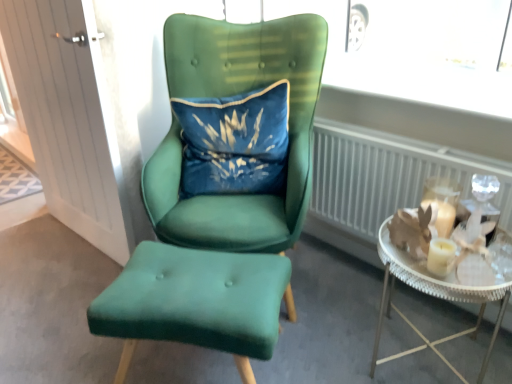
Question: Does white wood door at left have a lesser height compared to metallic silver tray at right?

Choices:
 (A) no
 (B) yes

Answer: (A)

Question: From a real-world perspective, does white wood door at left stand above metallic silver tray at right?

Choices:
 (A) no
 (B) yes

Answer: (B)

Question: From the image's perspective, is white wood door at left beneath metallic silver tray at right?

Choices:
 (A) yes
 (B) no

Answer: (B)

Question: Is white wood door at left in front of metallic silver tray at right?

Choices:
 (A) yes
 (B) no

Answer: (B)

Question: Is white wood door at left facing towards metallic silver tray at right?

Choices:
 (A) no
 (B) yes

Answer: (A)

Question: Considering their positions, is white wood door at left located in front of or behind velvet green chair at center, which appears as the second chair when ordered from the bottom?

Choices:
 (A) behind
 (B) front

Answer: (A)

Question: Considering the positions of white wood door at left and velvet green chair at center, which appears as the second chair when ordered from the bottom, in the image, is white wood door at left taller or shorter than velvet green chair at center, which appears as the second chair when ordered from the bottom,?

Choices:
 (A) tall
 (B) short

Answer: (A)

Question: Is white wood door at left inside or outside of velvet green chair at center, positioned as the first chair in top-to-bottom order?

Choices:
 (A) inside
 (B) outside

Answer: (B)

Question: From the image's perspective, relative to velvet green chair at center, which appears as the second chair when ordered from the bottom, is white wood door at left above or below?

Choices:
 (A) below
 (B) above

Answer: (B)

Question: Is white wood door at left taller or shorter than metallic silver tray at right?

Choices:
 (A) tall
 (B) short

Answer: (A)

Question: From the image's perspective, relative to metallic silver tray at right, is white wood door at left above or below?

Choices:
 (A) above
 (B) below

Answer: (A)

Question: Looking at the image, does white wood door at left seem bigger or smaller compared to metallic silver tray at right?

Choices:
 (A) big
 (B) small

Answer: (A)

Question: Does point [x=49, y=155] appear closer or farther from the camera than point [x=445, y=283]?

Choices:
 (A) farther
 (B) closer

Answer: (A)

Question: In the image, is white metallic radiator at right on the left side or the right side of velvet green chair at center, positioned as the first chair in top-to-bottom order?

Choices:
 (A) left
 (B) right

Answer: (B)

Question: Relative to velvet green chair at center, which appears as the second chair when ordered from the bottom, is white metallic radiator at right in front or behind?

Choices:
 (A) behind
 (B) front

Answer: (A)